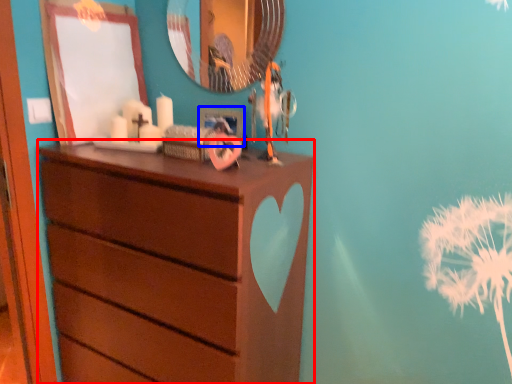
Question: Which of the following is the farthest to the observer, chest of drawers (highlighted by a red box) or picture frame (highlighted by a blue box)?

Choices:
 (A) chest of drawers
 (B) picture frame

Answer: (B)